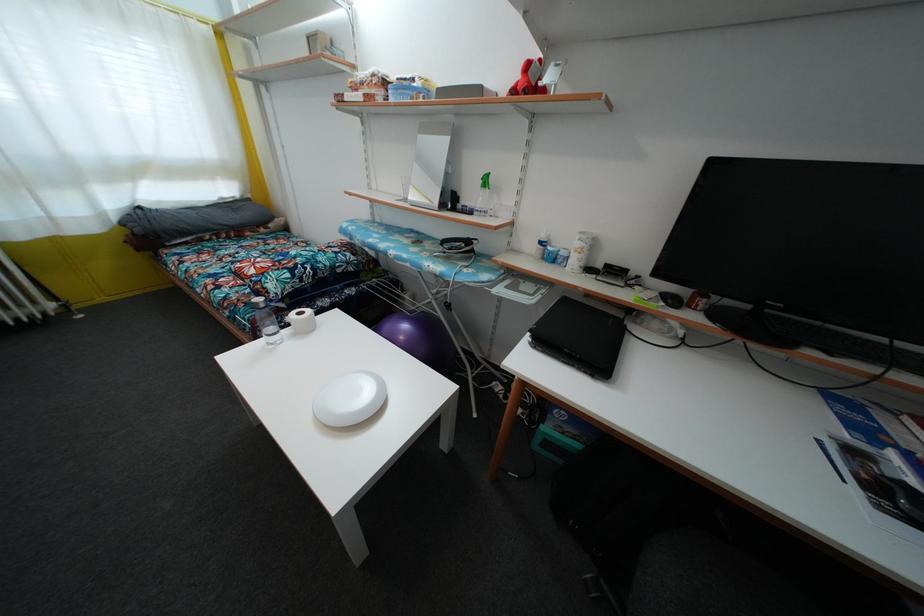
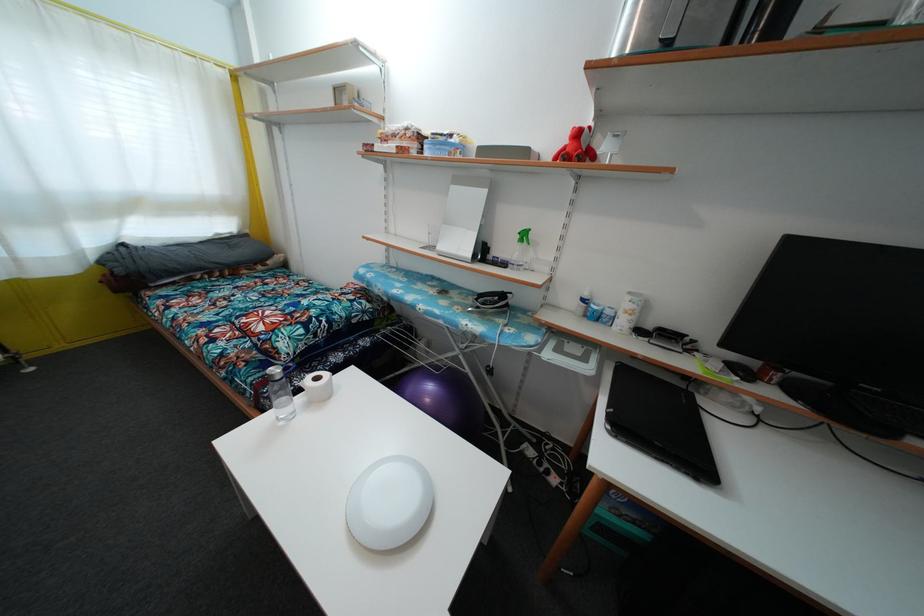
Where in the second image is the point corresponding to point 454,124 from the first image?

(488, 177)